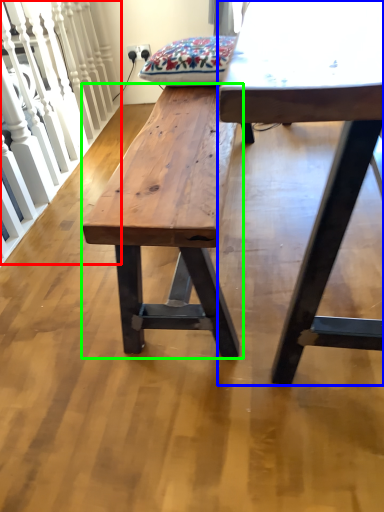
Question: Which is nearer to the rail (highlighted by a red box)? table (highlighted by a blue box) or bench (highlighted by a green box).

Choices:
 (A) table
 (B) bench

Answer: (B)